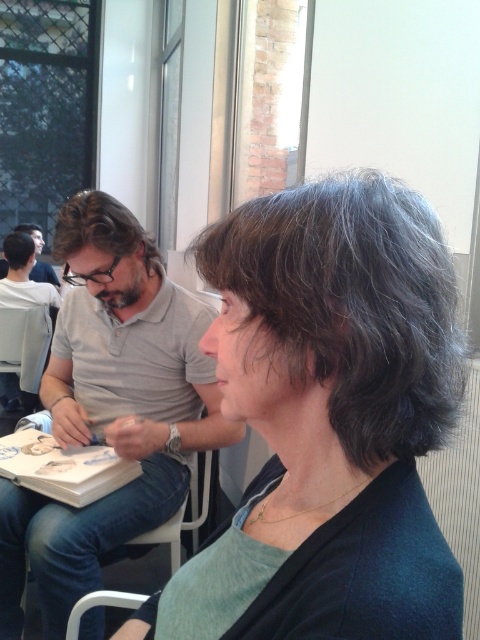
Question: Which point is closer to the camera?

Choices:
 (A) (54, 280)
 (B) (231, 298)
 (C) (126, 369)

Answer: (B)

Question: Is gray matte hair at center closer to camera compared to white shirt at left?

Choices:
 (A) yes
 (B) no

Answer: (A)

Question: Is matte gray shirt at left thinner than matte gray shirt at upper left?

Choices:
 (A) yes
 (B) no

Answer: (B)

Question: Does white plastic chair at lower left have a larger size compared to brownhair at left?

Choices:
 (A) no
 (B) yes

Answer: (B)

Question: Which point is closer to the camera?

Choices:
 (A) gray matte hair at center
 (B) white shirt at left

Answer: (A)

Question: Which of these objects is positioned farthest from the white shirt at left?

Choices:
 (A) matte gray shirt at upper left
 (B) dark brown hair at left
 (C) matte gray shirt at left
 (D) white plastic chair at lower left

Answer: (D)